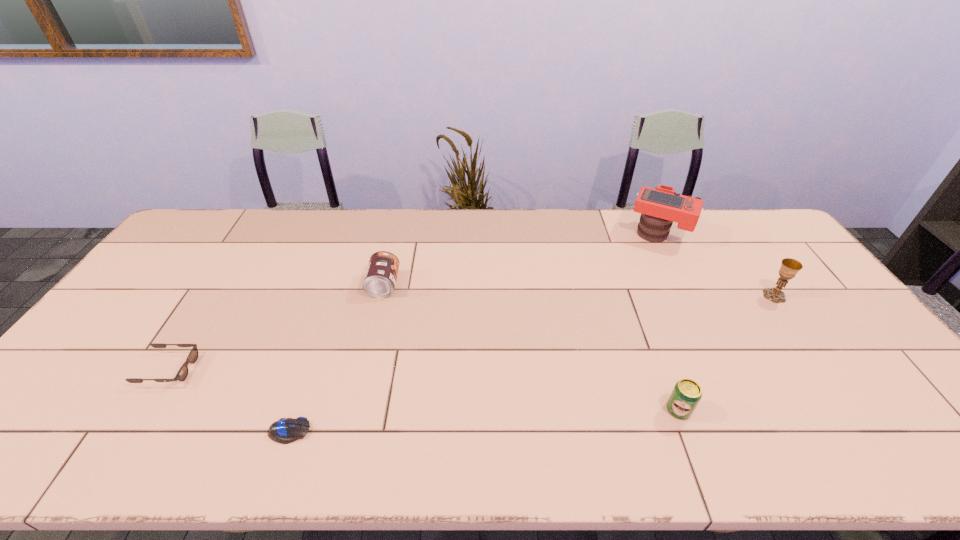
The image size is (960, 540). I want to click on vacant space located 0.050m on the right of the tallest object, so click(704, 235).

This screenshot has height=540, width=960. What are the coordinates of `vacant space located on the left of the chalice` in the screenshot? It's located at (720, 296).

I want to click on blank space located 0.190m on the front label of the can, so click(x=460, y=285).

You are a GUI agent. You are given a task and a screenshot of the screen. Output one action in this format:
    pyautogui.click(x=<x>, y=<y>)
    Task: Click on the vacant area located 0.240m on the left of the third object from right to left
    The height and width of the screenshot is (540, 960).
    Given the screenshot: What is the action you would take?
    pyautogui.click(x=565, y=409)

Find the location of a particular element. The height and width of the screenshot is (540, 960). vacant space located on the temples of the fourth farthest object is located at coordinates coord(282,369).

You are a GUI agent. You are given a task and a screenshot of the screen. Output one action in this format:
    pyautogui.click(x=<x>, y=<y>)
    Task: Click on the vacant region located 0.280m on the button side of the shortest object
    This screenshot has width=960, height=540.
    Given the screenshot: What is the action you would take?
    pyautogui.click(x=433, y=431)

Identify the location of object that is positioned at the far edge. (661, 206).

Where is `object located at the near edge`? object located at the near edge is located at coordinates (286, 430).

Identify the location of object that is at the right edge. (790, 267).

Where is `free location at the far edge of the desktop`? Image resolution: width=960 pixels, height=540 pixels. free location at the far edge of the desktop is located at coordinates (413, 215).